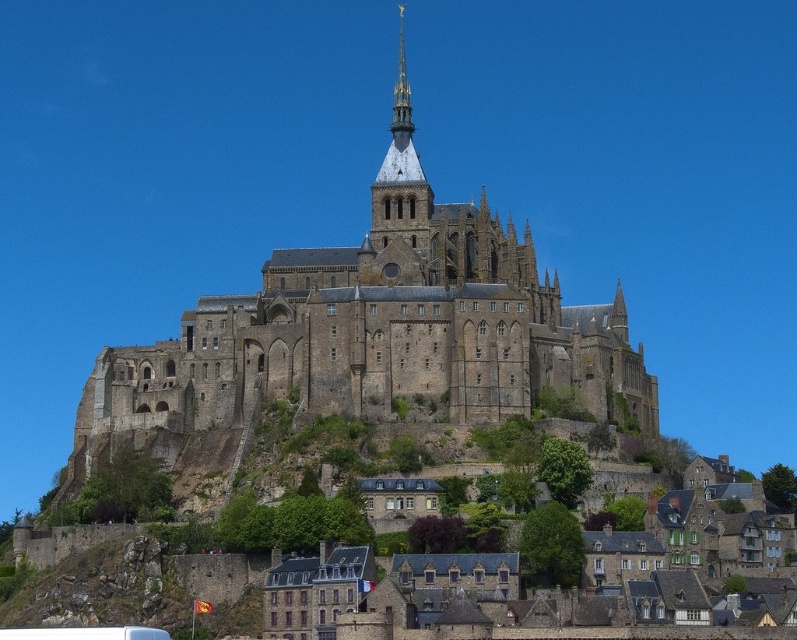
You are a tourist standing at the point marked by the coordinates (x=375, y=332) on the map of Mont Saint Michel. What is the most prominent structure you can see from this location?

The point marked by the coordinates (x=375, y=332) indicates the location of the brown stone castle at center, which is the most prominent structure visible from this vantage point.

You are a tourist standing on the beach facing Mont Saint Michel. You see the brown stone castle at center and the brown stone houses at lower center. Which structure is wider from your perspective?

The brown stone castle at center might be wider than brown stone houses at lower center based on the description provided.

You are a tourist standing on the beach looking up at Mont Saint Michel. You see the brown stone castle at center and the brown stone houses at lower center. Which structure is higher in elevation?

The brown stone castle at center is positioned over the brown stone houses at lower center, so it is higher in elevation.